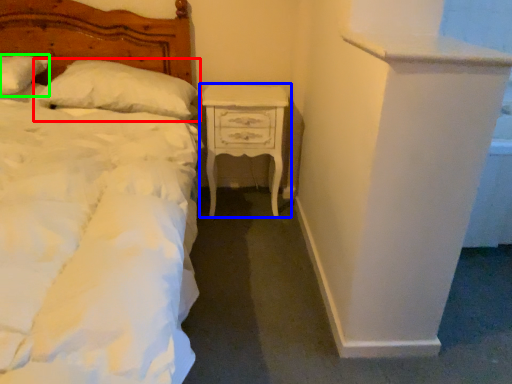
Question: Considering the real-world distances, which object is farthest from pillow (highlighted by a red box)? nightstand (highlighted by a blue box) or pillow (highlighted by a green box)?

Choices:
 (A) nightstand
 (B) pillow

Answer: (A)